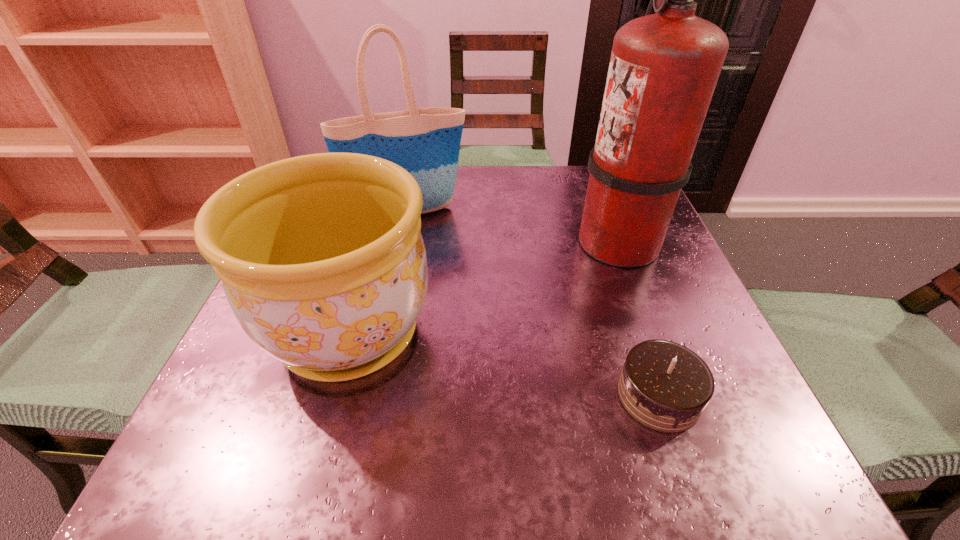
Where is `the tallest object`? the tallest object is located at coordinates (664, 66).

Identify the location of tote bag. Image resolution: width=960 pixels, height=540 pixels. (425, 142).

Find the location of a particular element. The image size is (960, 540). the second shortest object is located at coordinates (322, 260).

Identify the location of chocolate cake. This screenshot has width=960, height=540. (665, 386).

Where is `vacant space situated toward the nozzle of the tallest object`? Image resolution: width=960 pixels, height=540 pixels. vacant space situated toward the nozzle of the tallest object is located at coordinates (400, 240).

Where is `free space located toward the nozzle of the tallest object`? free space located toward the nozzle of the tallest object is located at coordinates (455, 240).

Identify the location of vacant region located 0.100m toward the nozzle of the tallest object. 525,240.

This screenshot has width=960, height=540. I want to click on free space located on the left of the second tallest object, so click(310, 214).

This screenshot has width=960, height=540. I want to click on vacant position located on the right of the third tallest object, so pyautogui.click(x=522, y=333).

You are a GUI agent. You are given a task and a screenshot of the screen. Output one action in this format:
    pyautogui.click(x=<x>, y=<y>)
    Task: Click on the free space located on the left of the shortest object
    
    Given the screenshot: What is the action you would take?
    pyautogui.click(x=540, y=396)